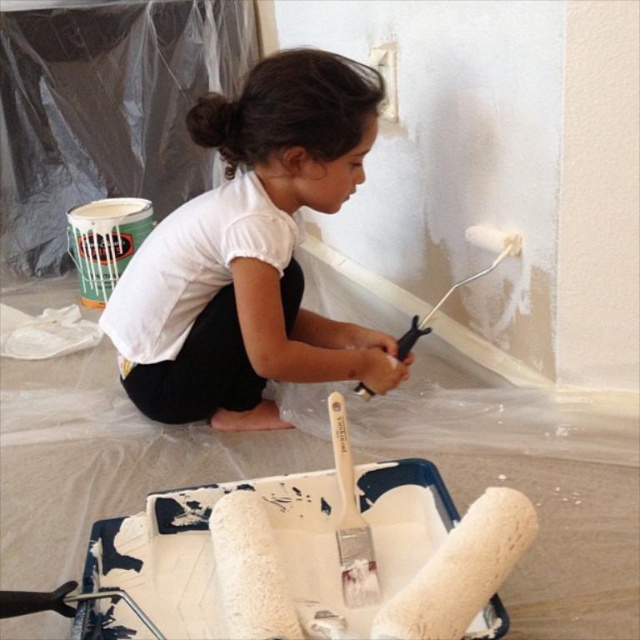
Is white matte shirt at center positioned at the back of white matte paint roller at upper center?

No, white matte shirt at center is in front of white matte paint roller at upper center.

Describe the element at coordinates (252, 253) in the screenshot. The width and height of the screenshot is (640, 640). I see `white matte shirt at center` at that location.

Where is `white matte shirt at center`? Image resolution: width=640 pixels, height=640 pixels. white matte shirt at center is located at coordinates (252, 253).